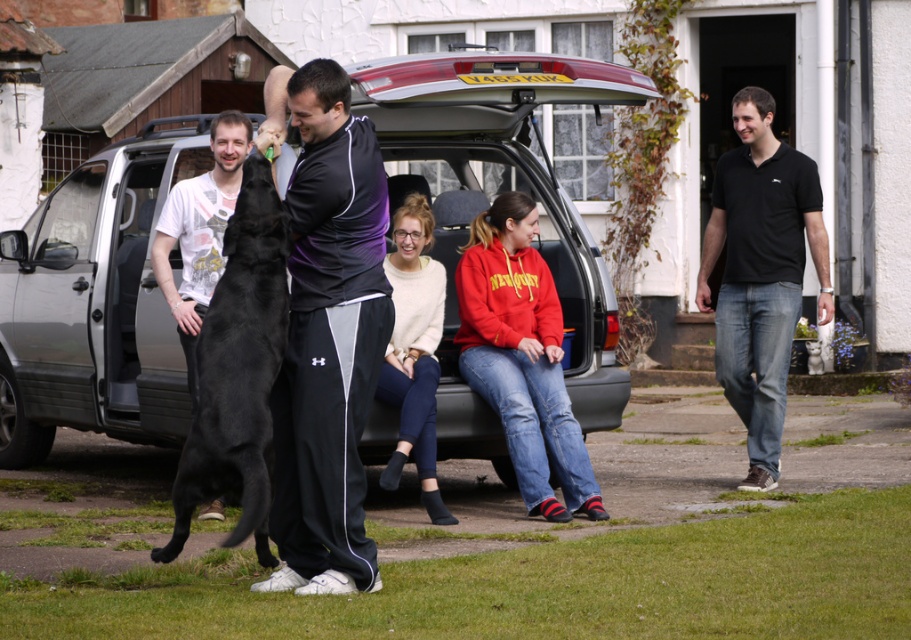
Between black cotton polo shirt at right and soft cream sweater at center, which one appears on the left side from the viewer's perspective?

From the viewer's perspective, soft cream sweater at center appears more on the left side.

Consider the image. Between black cotton polo shirt at right and soft cream sweater at center, which one has more height?

black cotton polo shirt at right is taller.

Which is behind, point (765, 179) or point (428, 500)?

Positioned behind is point (765, 179).

Find the location of a particular element. This screenshot has width=911, height=640. black cotton polo shirt at right is located at coordinates click(761, 273).

Which is more to the left, purple/black track pants at center or soft cream sweater at center?

Positioned to the left is purple/black track pants at center.

What do you see at coordinates (326, 332) in the screenshot? This screenshot has width=911, height=640. I see `purple/black track pants at center` at bounding box center [326, 332].

At what (x,y) coordinates should I click in order to perform the action: click on purple/black track pants at center. Please return your answer as a coordinate pair (x, y). This screenshot has width=911, height=640. Looking at the image, I should click on coord(326,332).

Between point (309, 243) and point (559, 477), which one is positioned in front?

Point (309, 243)

Which is above, purple/black track pants at center or red fleece sweatshirt at center?

purple/black track pants at center is above.

The width and height of the screenshot is (911, 640). What do you see at coordinates (326, 332) in the screenshot? I see `purple/black track pants at center` at bounding box center [326, 332].

Find the location of a particular element. purple/black track pants at center is located at coordinates (326, 332).